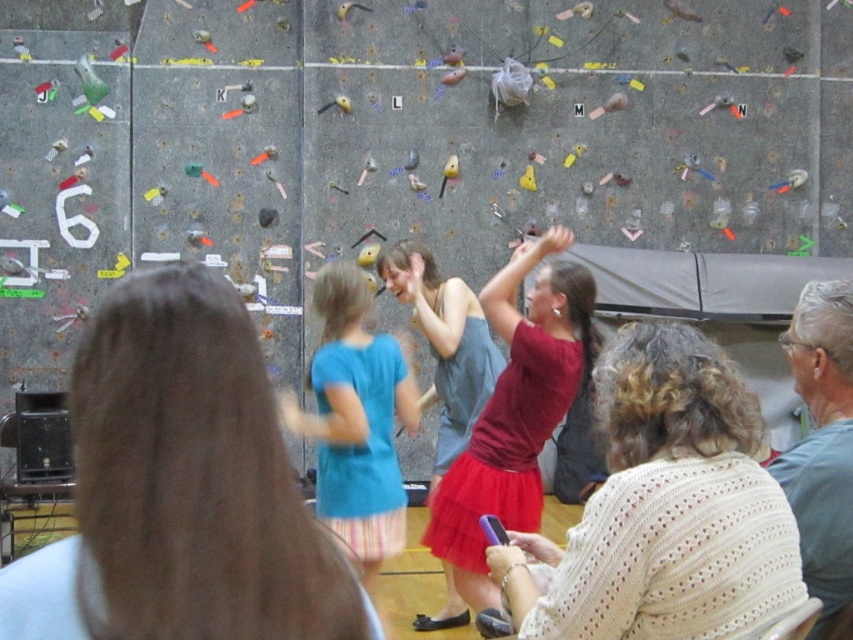
You are a photographer standing at the back of the climbing wall. You want to take a photo of the matte red skirt at center and blue cotton shirt at center so that both are clearly visible in the frame. Considering the distance between them, what is the minimum width of the camera lens you need to capture both subjects without moving the camera?

The minimum width of the camera lens needed to capture both the matte red skirt at center and blue cotton shirt at center is at least 43.58 centimeters, as that is the distance between them.

You are standing at the entrance of the climbing wall area and see the matte red skirt at center. If you want to move closer to it, which direction should you walk? Please provide the coordinates as a reference.

The matte red skirt at center is located at point (515, 412), so you should walk towards the coordinates (515, 412) to get closer.

You are a photographer positioned at the center of the climbing wall scene. You want to take a photo that includes both the matte red skirt at center and the blue cotton shirt at center. Which direction should you move to ensure both are in the frame?

The matte red skirt at center is to the right of blue cotton shirt at center. To include both in the frame, you should move to the left so that the blue cotton shirt at center is on your right and the matte red skirt at center is on your left, ensuring both are within the camera view.